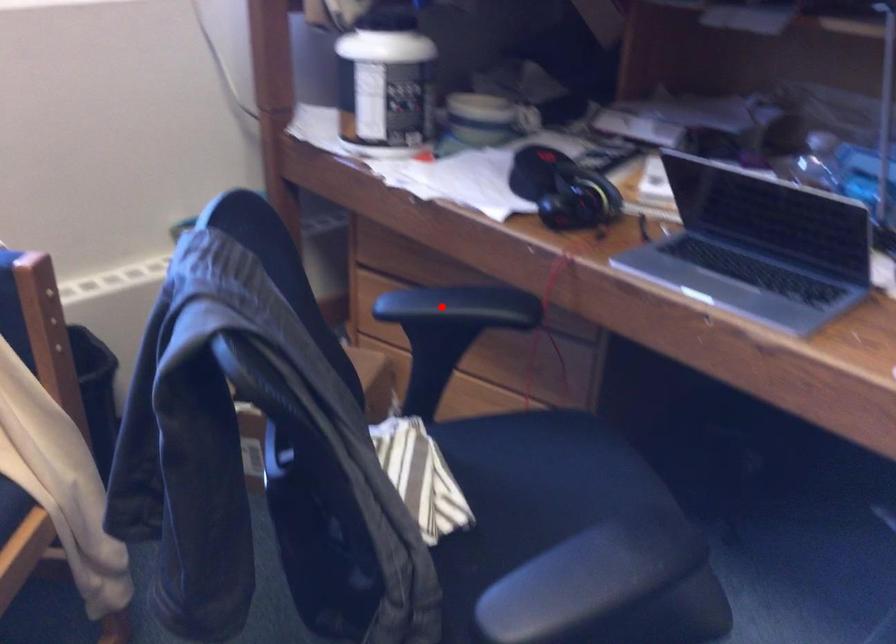
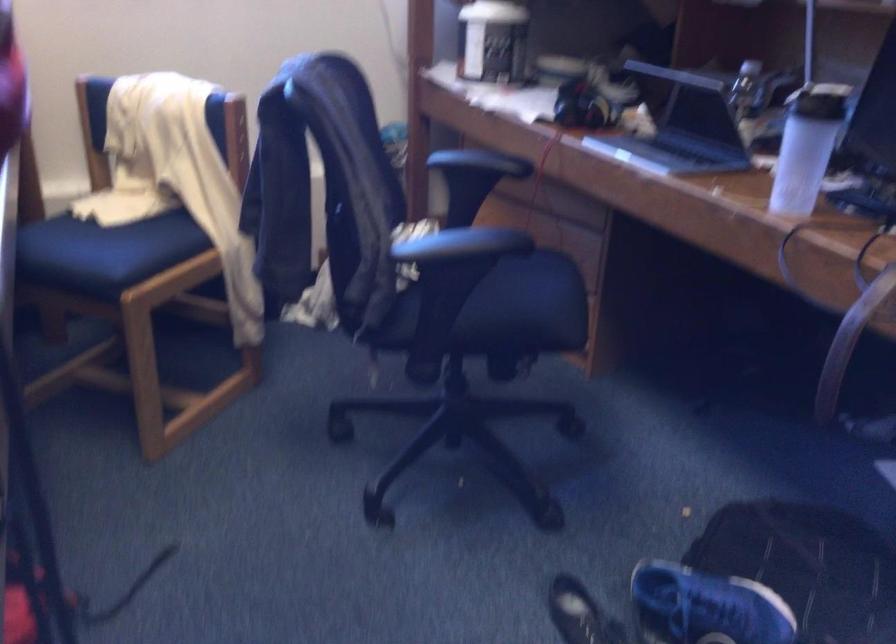
Find the pixel in the second image that matches the highlighted location in the first image.

(466, 158)